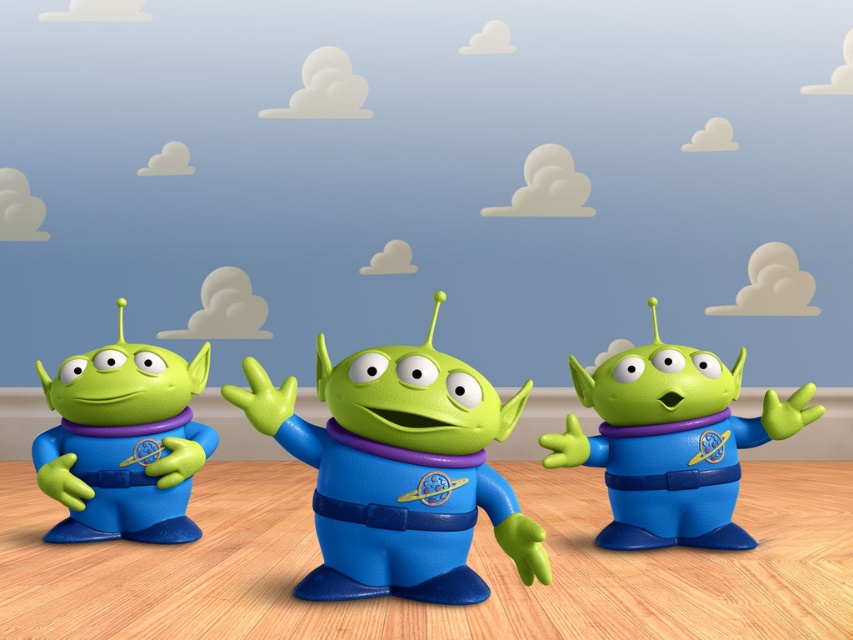
You are setting up a display and need to arrange the matte plastic alien at center and the matte plastic alien at left on a shelf. Given that the shelf has limited space, which alien should you place first to ensure both fit properly?

The matte plastic alien at left should be placed first because it is smaller in width compared to the matte plastic alien at center, allowing both to fit on the shelf more easily.